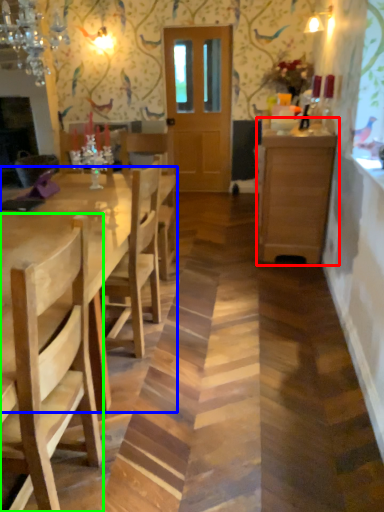
Question: Which object is positioned closest to cabinetry (highlighted by a red box)? Select from kitchen & dining room table (highlighted by a blue box) and chair (highlighted by a green box).

Choices:
 (A) kitchen & dining room table
 (B) chair

Answer: (A)